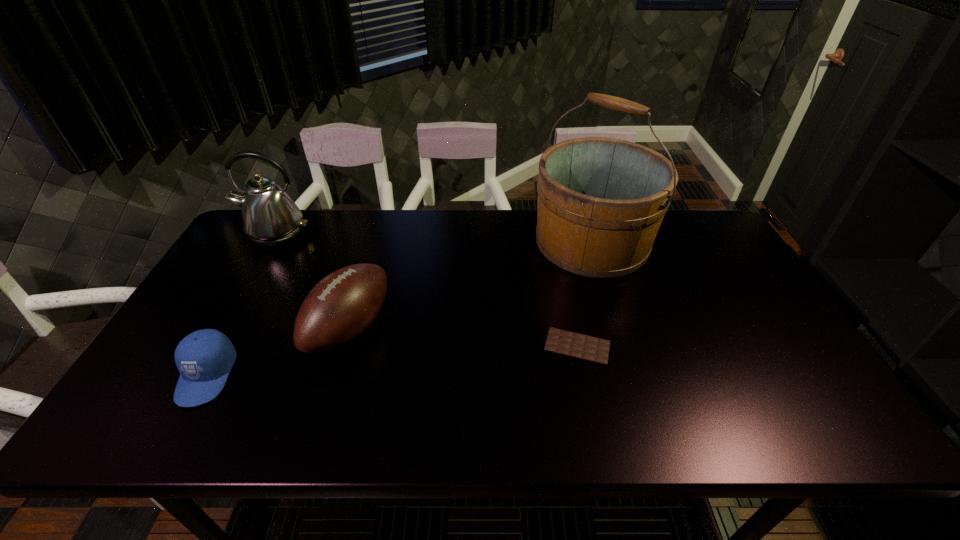
Where is `vacant space located on the right of the shortest object`? The height and width of the screenshot is (540, 960). vacant space located on the right of the shortest object is located at coordinates (651, 346).

At what (x,y) coordinates should I click in order to perform the action: click on bucket that is at the far edge. Please return your answer as a coordinate pair (x, y). Looking at the image, I should click on [x=601, y=201].

Image resolution: width=960 pixels, height=540 pixels. I want to click on kettle present at the far edge, so click(x=270, y=218).

You are a GUI agent. You are given a task and a screenshot of the screen. Output one action in this format:
    pyautogui.click(x=<x>, y=<y>)
    Task: Click on the object that is at the near edge
    The image size is (960, 540).
    Given the screenshot: What is the action you would take?
    pyautogui.click(x=204, y=358)

In order to click on kettle at the left edge in this screenshot , I will do coord(270,218).

Find the location of a particular element. cap located in the left edge section of the desktop is located at coordinates (204, 358).

Image resolution: width=960 pixels, height=540 pixels. I want to click on object that is at the far left corner, so click(x=270, y=218).

At what (x,y) coordinates should I click in order to perform the action: click on object that is at the near left corner. Please return your answer as a coordinate pair (x, y). This screenshot has width=960, height=540. Looking at the image, I should click on (204, 358).

You are a GUI agent. You are given a task and a screenshot of the screen. Output one action in this format:
    pyautogui.click(x=<x>, y=<y>)
    Task: Click on the vacant region at the far edge of the desktop
    The image size is (960, 540).
    Given the screenshot: What is the action you would take?
    pyautogui.click(x=354, y=233)

Where is `vacant area at the near edge of the desktop`? The image size is (960, 540). vacant area at the near edge of the desktop is located at coordinates pos(674,407).